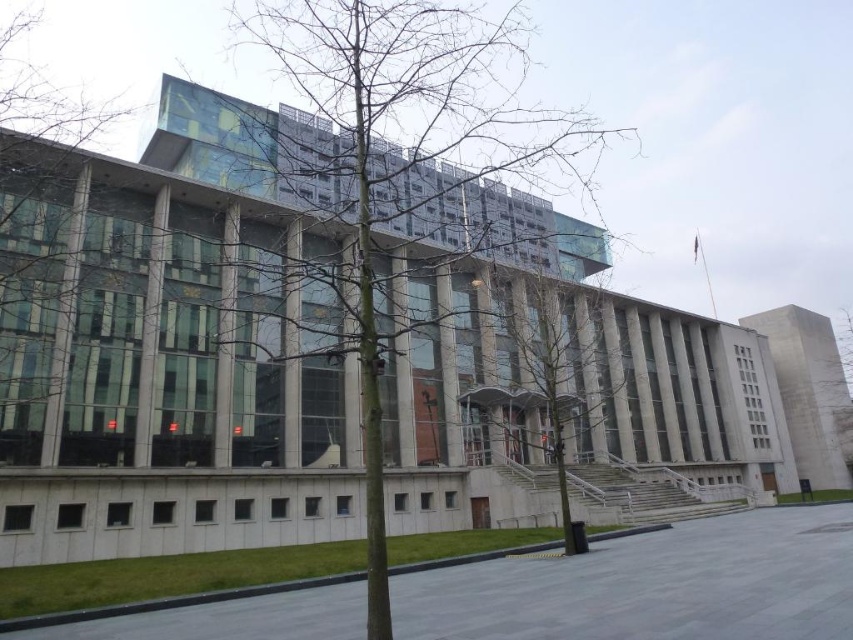
Consider the image. Can you confirm if bare branches at center is positioned below green leafless tree at center?

Actually, bare branches at center is above green leafless tree at center.

Is bare branches at center smaller than green leafless tree at center?

No, bare branches at center is not smaller than green leafless tree at center.

Who is more distant from viewer, (486, 61) or (544, 358)?

The point (544, 358) is more distant.

Locate an element on the screen. The height and width of the screenshot is (640, 853). bare branches at center is located at coordinates (415, 156).

Which is below, bare branches at center or green leafless tree at left?

bare branches at center is lower down.

Locate an element on the screen. bare branches at center is located at coordinates (415, 156).

Locate an element on the screen. bare branches at center is located at coordinates 415,156.

Based on the photo, is green leafless tree at center closer to the viewer compared to green leafless tree at right?

Yes.

Find the location of a particular element. green leafless tree at center is located at coordinates (543, 380).

I want to click on green leafless tree at center, so click(543, 380).